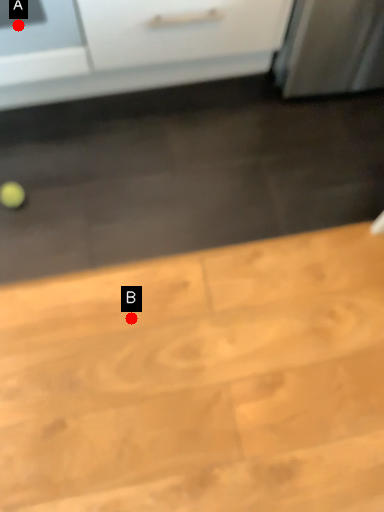
Question: Two points are circled on the image, labeled by A and B beside each circle. Which point appears closest to the camera in this image?

Choices:
 (A) A is closer
 (B) B is closer

Answer: (A)